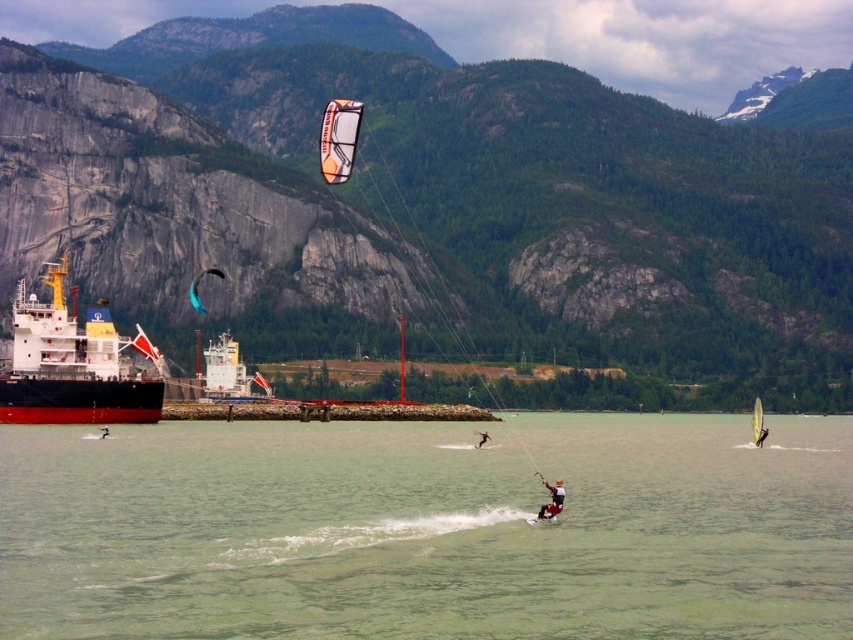
Which is in front, point (685, 156) or point (482, 432)?

Point (482, 432)

Based on the photo, who is positioned more to the left, gray rock mountain at upper left or black matte wetsuit at center?

Result: black matte wetsuit at center

Is point (722, 310) farther from viewer compared to point (474, 448)?

Yes, point (722, 310) is behind point (474, 448).

I want to click on gray rock mountain at upper left, so click(x=430, y=198).

Does white fabric sail at center appear on the left side of black matte wetsuit at center?

In fact, white fabric sail at center is to the right of black matte wetsuit at center.

Who is positioned more to the right, white fabric sail at center or black matte wetsuit at center?

white fabric sail at center is more to the right.

Which is in front, point (764, 436) or point (476, 429)?

Positioned in front is point (764, 436).

Where is `white fabric sail at center`? This screenshot has height=640, width=853. white fabric sail at center is located at coordinates pos(759,436).

Does gray rock mountain at upper left appear under teal fabric parachute at center?

Answer: No.

Is gray rock mountain at upper left shorter than teal fabric parachute at center?

No.

The height and width of the screenshot is (640, 853). Identify the location of gray rock mountain at upper left. point(430,198).